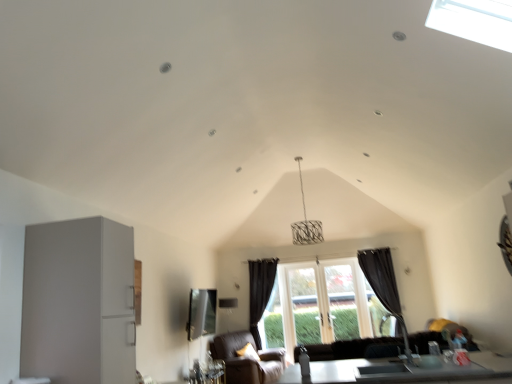
The image size is (512, 384). What do you see at coordinates (410, 371) in the screenshot?
I see `metallic silver table at lower right` at bounding box center [410, 371].

Where is `metallic silver table at lower right`? The image size is (512, 384). metallic silver table at lower right is located at coordinates 410,371.

Describe the element at coordinates (79, 302) in the screenshot. I see `matte white refrigerator at left` at that location.

What is the approximate width of brown leather armchair at lower center?

brown leather armchair at lower center is 36.64 inches wide.

What is the approximate width of matte glass window screen at center?

matte glass window screen at center is 13.73 inches in width.

The width and height of the screenshot is (512, 384). Find the location of `black fabric curtain at right, placed as the second curtain when sorted from left to right`. black fabric curtain at right, placed as the second curtain when sorted from left to right is located at coordinates (382, 281).

Based on their sizes in the image, would you say black fabric curtain at right, placed as the 1th curtain when sorted from right to left, is bigger or smaller than black fabric curtain at center, which is counted as the first curtain, starting from the left?

black fabric curtain at right, placed as the 1th curtain when sorted from right to left, is bigger than black fabric curtain at center, which is counted as the first curtain, starting from the left.

Which is more to the right, black fabric curtain at right, placed as the 1th curtain when sorted from right to left, or black fabric curtain at center, which ranks as the second curtain in right-to-left order?

Positioned to the right is black fabric curtain at right, placed as the 1th curtain when sorted from right to left.

From a real-world perspective, is black fabric curtain at right, placed as the 1th curtain when sorted from right to left, below black fabric curtain at center, which ranks as the second curtain in right-to-left order?

No.

Is black fabric curtain at right, placed as the second curtain when sorted from left to right, oriented towards black fabric curtain at center, which is counted as the first curtain, starting from the left?

No, black fabric curtain at right, placed as the second curtain when sorted from left to right, does not turn towards black fabric curtain at center, which is counted as the first curtain, starting from the left.

Does point (365, 312) come farther from viewer compared to point (98, 271)?

Yes, it is behind point (98, 271).

Is matte white refrigerator at left located within transparent glass window at center?

No.

In the scene shown: Is transparent glass window at center in front of or behind matte white refrigerator at left in the image?

Clearly, transparent glass window at center is behind matte white refrigerator at left.

Looking at this image, is metallic silver table at lower right taller or shorter than brown leather armchair at lower center?

In the image, metallic silver table at lower right appears to be shorter than brown leather armchair at lower center.

Which is correct: metallic silver table at lower right is inside brown leather armchair at lower center, or outside of it?

metallic silver table at lower right exists outside the volume of brown leather armchair at lower center.

From a real-world perspective, between metallic silver table at lower right and brown leather armchair at lower center, who is vertically lower?

brown leather armchair at lower center is physically lower.

Can you see metallic silver table at lower right touching brown leather armchair at lower center?

No.

Can you confirm if matte glass window screen at center is positioned to the left of metallic silver table at lower right?

Indeed, matte glass window screen at center is positioned on the left side of metallic silver table at lower right.

From a real-world perspective, which object stands above the other?

matte glass window screen at center, from a real-world perspective.

Is point (200, 333) positioned before point (443, 366)?

No, (200, 333) is behind (443, 366).

Is matte glass window screen at center wider than metallic silver table at lower right?

Incorrect, the width of matte glass window screen at center does not surpass that of metallic silver table at lower right.

Is brown leather armchair at lower center positioned with its back to transparent glass window at center?

brown leather armchair at lower center does not have its back to transparent glass window at center.

Is point (231, 362) closer to viewer compared to point (262, 330)?

Yes, it is in front of point (262, 330).

Is brown leather armchair at lower center placed right next to transparent glass window at center?

brown leather armchair at lower center is not next to transparent glass window at center, and they're not touching.

Would you say brown leather armchair at lower center is to the left or to the right of transparent glass window at center in the picture?

From the image, it's evident that brown leather armchair at lower center is to the left of transparent glass window at center.

Considering the positions of point (124, 332) and point (356, 268), is point (124, 332) closer or farther from the camera than point (356, 268)?

Point (124, 332) appears to be closer to the viewer than point (356, 268).

Considering the sizes of matte white refrigerator at left and transparent glass window at center in the image, is matte white refrigerator at left taller or shorter than transparent glass window at center?

In the image, matte white refrigerator at left appears to be shorter than transparent glass window at center.

Is matte white refrigerator at left oriented towards transparent glass window at center?

No, matte white refrigerator at left is not oriented towards transparent glass window at center.

How much distance is there between matte white refrigerator at left and transparent glass window at center?

A distance of 4.70 meters exists between matte white refrigerator at left and transparent glass window at center.

Who is bigger, brown leather armchair at lower center or matte white refrigerator at left?

brown leather armchair at lower center.

What's the angular difference between brown leather armchair at lower center and matte white refrigerator at left's facing directions?

24.4 degrees.

Can you confirm if brown leather armchair at lower center is shorter than matte white refrigerator at left?

Yes.

Which object is positioned more to the left, brown leather armchair at lower center or matte white refrigerator at left?

matte white refrigerator at left.

You are a GUI agent. You are given a task and a screenshot of the screen. Output one action in this format:
    pyautogui.click(x=<x>, y=<y>)
    Task: Click on the curtain that appears above the black fabric curtain at center, which ranks as the second curtain in right-to-left order (from a real-world perspective)
    This screenshot has width=512, height=384.
    Given the screenshot: What is the action you would take?
    pyautogui.click(x=382, y=281)

I want to click on window beneath the matte white refrigerator at left (from a real-world perspective), so click(321, 305).

Which object lies nearer to the anchor point metallic silver table at lower right, black fabric curtain at right, placed as the second curtain when sorted from left to right, or matte glass window screen at center?

black fabric curtain at right, placed as the second curtain when sorted from left to right.

Estimate the real-world distances between objects in this image. Which object is further from black fabric curtain at right, placed as the 1th curtain when sorted from right to left, brown leather armchair at lower center or black fabric curtain at center, which ranks as the second curtain in right-to-left order?

The object further to black fabric curtain at right, placed as the 1th curtain when sorted from right to left, is brown leather armchair at lower center.

Based on their spatial positions, is matte glass window screen at center or transparent glass window at center further from brown leather armchair at lower center?

The object further to brown leather armchair at lower center is transparent glass window at center.

When comparing their distances from matte glass window screen at center, does black fabric curtain at center, which is counted as the first curtain, starting from the left, or brown leather armchair at lower center seem further?

black fabric curtain at center, which is counted as the first curtain, starting from the left, is positioned further to the anchor matte glass window screen at center.

When comparing their distances from matte glass window screen at center, does black fabric curtain at right, placed as the 1th curtain when sorted from right to left, or metallic silver table at lower right seem closer?

Among the two, black fabric curtain at right, placed as the 1th curtain when sorted from right to left, is located nearer to matte glass window screen at center.

Which object lies nearer to the anchor point matte white refrigerator at left, black fabric curtain at right, placed as the second curtain when sorted from left to right, or metallic silver table at lower right?

metallic silver table at lower right.

Considering their positions, is brown leather armchair at lower center positioned closer to transparent glass window at center than black fabric curtain at center, which is counted as the first curtain, starting from the left?

The object closer to transparent glass window at center is black fabric curtain at center, which is counted as the first curtain, starting from the left.

Estimate the real-world distances between objects in this image. Which object is further from transparent glass window at center, metallic silver table at lower right or matte glass window screen at center?

metallic silver table at lower right is positioned further to the anchor transparent glass window at center.

Where is `curtain between metallic silver table at lower right and black fabric curtain at center, which ranks as the second curtain in right-to-left order, from front to back`? The width and height of the screenshot is (512, 384). curtain between metallic silver table at lower right and black fabric curtain at center, which ranks as the second curtain in right-to-left order, from front to back is located at coordinates (382, 281).

Find the location of a particular element. This screenshot has height=384, width=512. window screen situated between matte white refrigerator at left and metallic silver table at lower right from left to right is located at coordinates (201, 313).

This screenshot has width=512, height=384. Find the location of `furniture between metallic silver table at lower right and transparent glass window at center along the z-axis`. furniture between metallic silver table at lower right and transparent glass window at center along the z-axis is located at coordinates (246, 359).

Locate an element on the screen. The height and width of the screenshot is (384, 512). furniture between matte glass window screen at center and black fabric curtain at center, which ranks as the second curtain in right-to-left order, in the front-back direction is located at coordinates (246, 359).